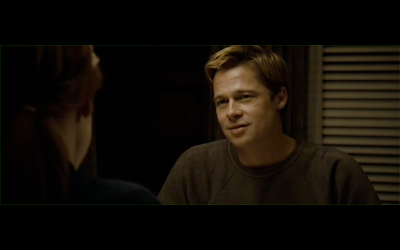
Find the location of a particular element. The image size is (400, 250). window blinds is located at coordinates (376, 165).